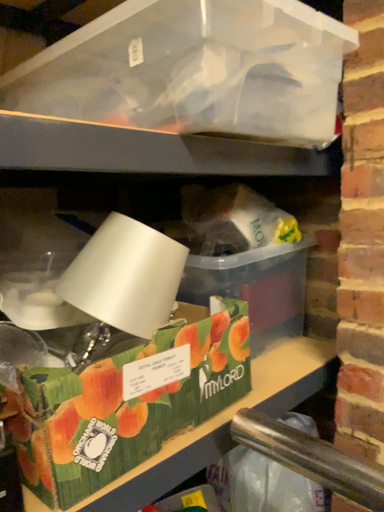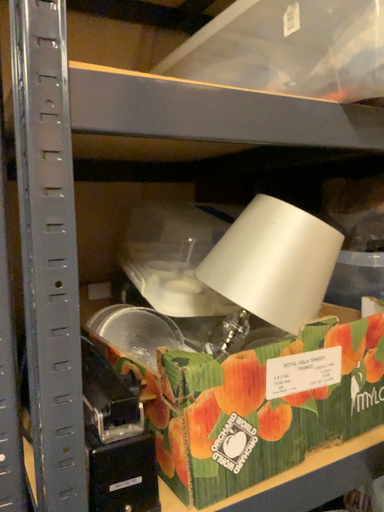
Question: Which way did the camera rotate in the video?

Choices:
 (A) rotated right
 (B) rotated left

Answer: (B)